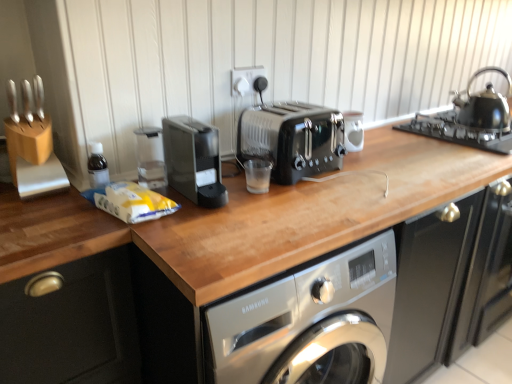
You are a GUI agent. You are given a task and a screenshot of the screen. Output one action in this format:
    pyautogui.click(x=<x>, y=<y>)
    Task: Click on the vacant space in front of black plastic coffee machine at center
    The height and width of the screenshot is (384, 512).
    Given the screenshot: What is the action you would take?
    pyautogui.click(x=204, y=220)